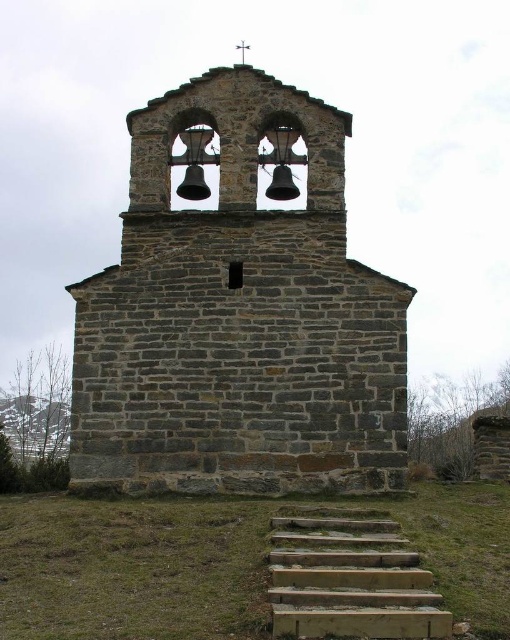
The height and width of the screenshot is (640, 510). Describe the element at coordinates (238, 314) in the screenshot. I see `gray stone church at center` at that location.

Is point (164, 237) closer to camera compared to point (389, 621)?

No, (164, 237) is behind (389, 621).

Between point (154, 209) and point (425, 630), which one is positioned in front?

Point (425, 630)

I want to click on gray stone church at center, so click(x=238, y=314).

Can you confirm if gray stone church at center is thinner than green grass at lower center?

Indeed, gray stone church at center has a lesser width compared to green grass at lower center.

Between point (379, 445) and point (487, 554), which one is positioned behind?

The point (379, 445) is more distant.

The height and width of the screenshot is (640, 510). I want to click on gray stone church at center, so click(x=238, y=314).

Is point (48, 602) behind point (420, 628)?

Yes, it is behind point (420, 628).

Does green grass at lower center come in front of wooden stairs at lower center?

That is True.

Image resolution: width=510 pixels, height=640 pixels. I want to click on green grass at lower center, so click(134, 566).

You are a GUI agent. You are given a task and a screenshot of the screen. Output one action in this format:
    pyautogui.click(x=<x>, y=<y>)
    Task: Click on the green grass at lower center
    
    Given the screenshot: What is the action you would take?
    pyautogui.click(x=134, y=566)